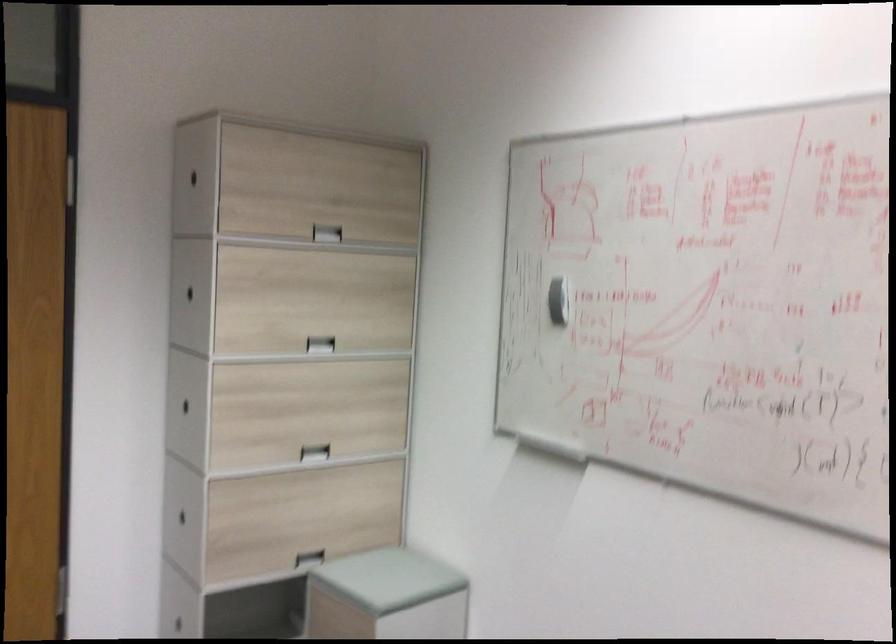
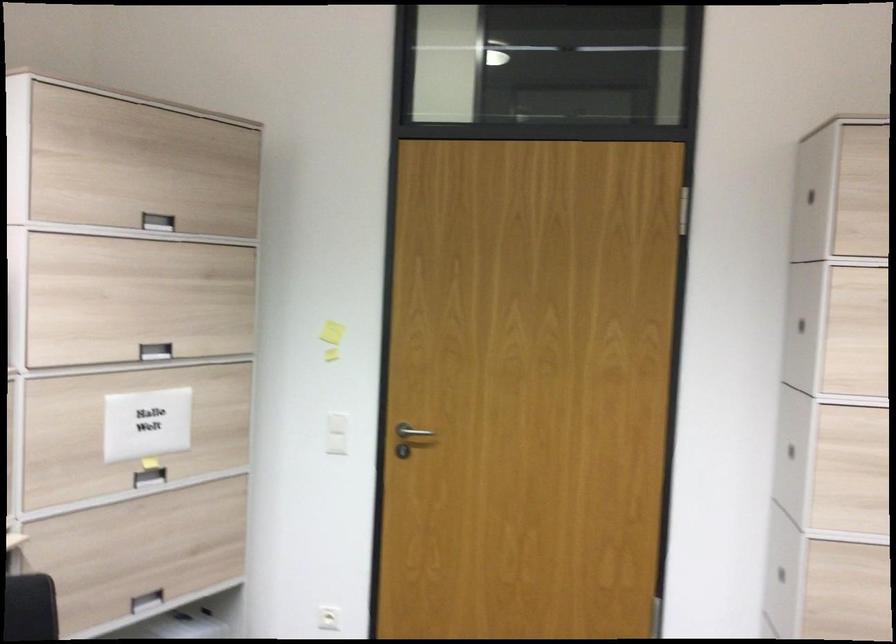
Question: The first image is from the beginning of the video and the second image is from the end. How did the camera likely rotate when shooting the video?

Choices:
 (A) Left
 (B) Right
 (C) Up
 (D) Down

Answer: (A)